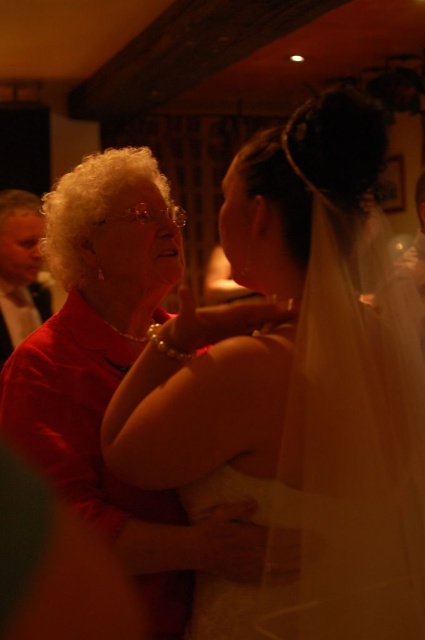
Which of these two, white satin dress at center or matte red shirt at left, stands taller?

Standing taller between the two is matte red shirt at left.

What do you see at coordinates (295, 392) in the screenshot? I see `white satin dress at center` at bounding box center [295, 392].

Is point (311, 381) positioned before point (22, 316)?

That is True.

You are a GUI agent. You are given a task and a screenshot of the screen. Output one action in this format:
    pyautogui.click(x=<x>, y=<y>)
    Task: Click on the white satin dress at center
    Image resolution: width=425 pixels, height=640 pixels.
    Given the screenshot: What is the action you would take?
    pyautogui.click(x=295, y=392)